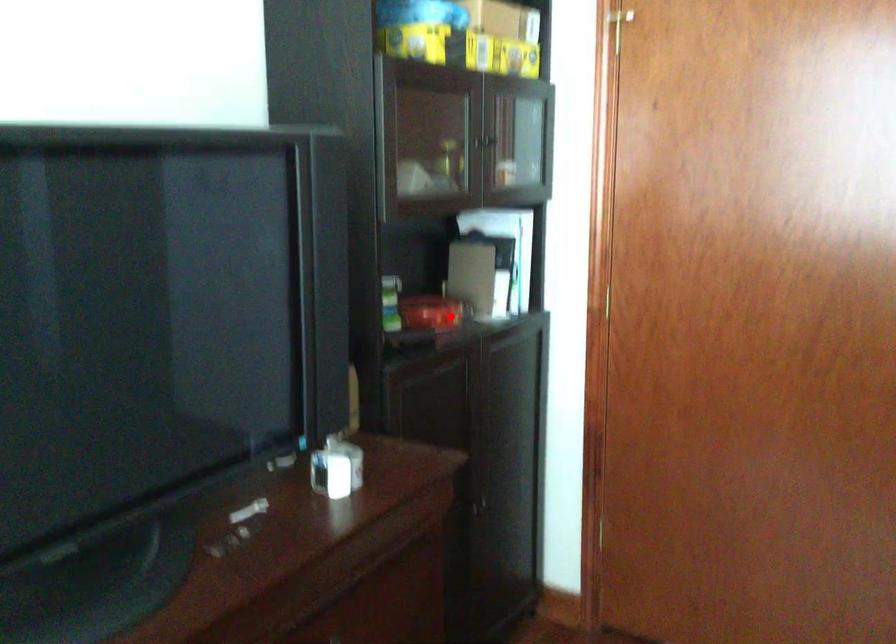
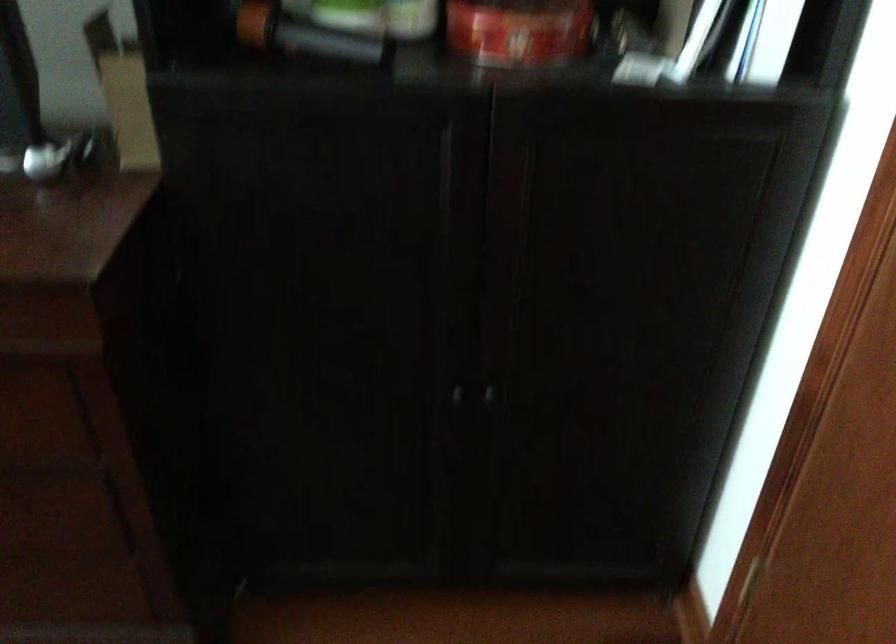
Where in the second image is the point corresponding to the highlighted location from the first image?

(519, 31)